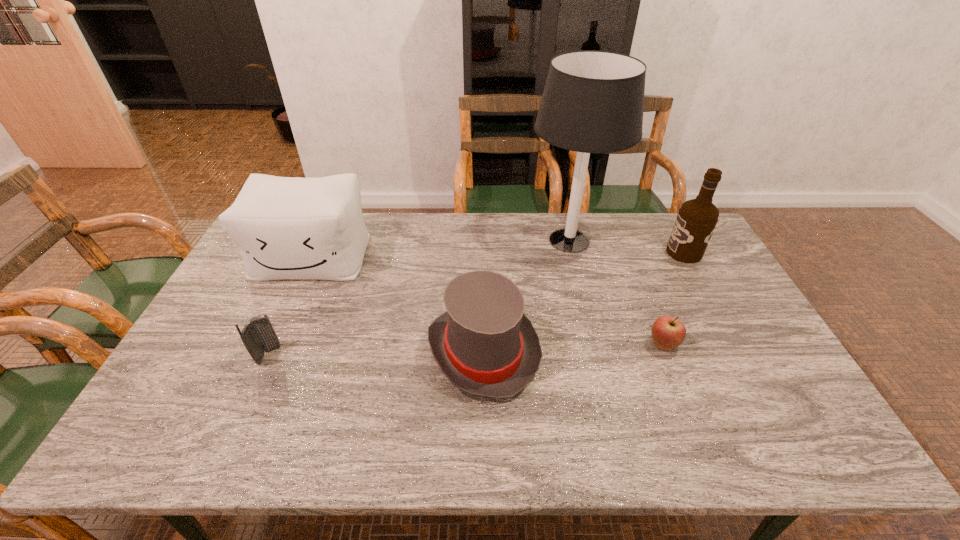
The image size is (960, 540). I want to click on object that is positioned at the far right corner, so click(696, 220).

You are a GUI agent. You are given a task and a screenshot of the screen. Output one action in this format:
    pyautogui.click(x=<x>, y=<y>)
    Task: Click on the free spot at the far edge of the desktop
    The width and height of the screenshot is (960, 540).
    Given the screenshot: What is the action you would take?
    pyautogui.click(x=533, y=221)

This screenshot has height=540, width=960. What are the coordinates of `vacant space at the left edge of the desktop` in the screenshot? It's located at (272, 289).

In the image, there is a desktop. Identify the location of vacant space at the right edge. (739, 372).

This screenshot has height=540, width=960. I want to click on free space between the cushion and the cellular telephone, so click(290, 306).

Identify the location of free area in between the table lamp and the cushion. (441, 248).

Find the location of a particular element. Image resolution: width=960 pixels, height=540 pixels. vacant region between the cushion and the second shortest object is located at coordinates (290, 306).

Find the location of a particular element. The width and height of the screenshot is (960, 540). vacant space that is in between the cushion and the tallest object is located at coordinates (441, 248).

You are a GUI agent. You are given a task and a screenshot of the screen. Output one action in this format:
    pyautogui.click(x=<x>, y=<y>)
    Task: Click on the blank region between the cellular telephone and the cushion
    The height and width of the screenshot is (540, 960).
    Given the screenshot: What is the action you would take?
    pyautogui.click(x=290, y=306)

You are a GUI agent. You are given a task and a screenshot of the screen. Output one action in this format:
    pyautogui.click(x=<x>, y=<y>)
    Task: Click on the vacant point located between the shortest object and the alcohol
    
    Given the screenshot: What is the action you would take?
    pyautogui.click(x=674, y=299)